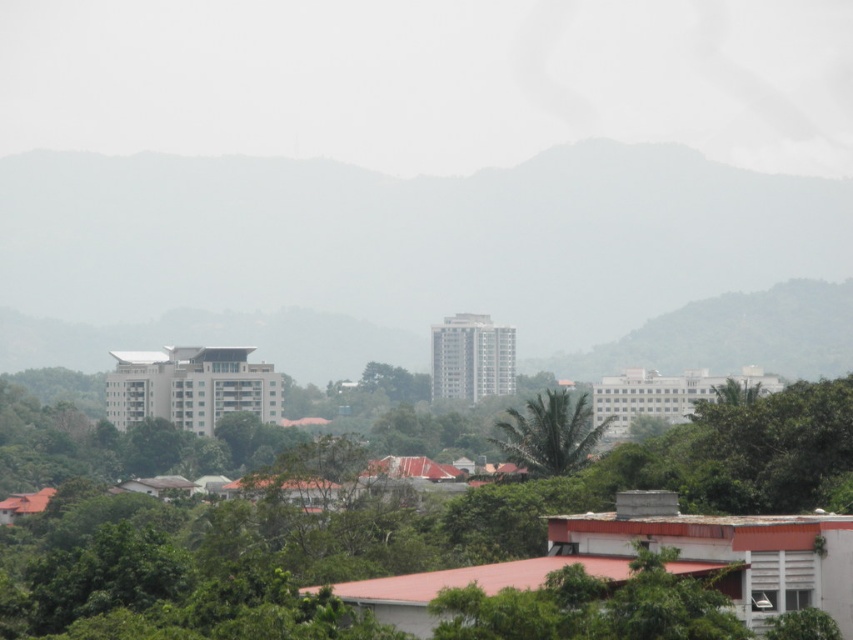
You are standing at the point marked as point [386,252] in the cityscape. What is the closest object to you?

The closest object to you at point [386,252] is the green matte mountain at center, as it is located exactly at that coordinate.

Based on the given coordinates, where is the green matte mountain at center located in the image?

The green matte mountain at center is located at point coordinates of (386, 252).